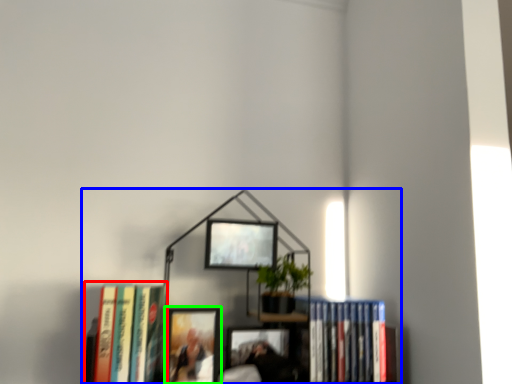
Question: Which is farther away from book (highlighted by a red box)? bookcase (highlighted by a blue box) or picture frame (highlighted by a green box)?

Choices:
 (A) bookcase
 (B) picture frame

Answer: (A)